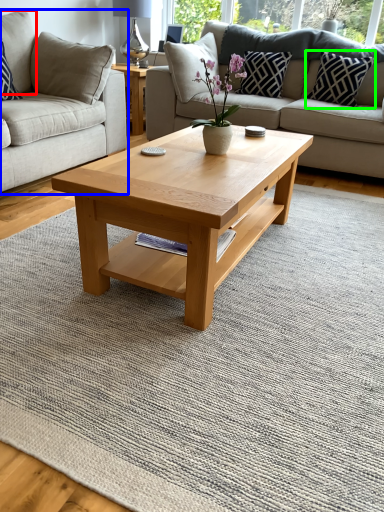
Question: Based on their relative distances, which object is nearer to pillow (highlighted by a red box)? Choose from studio couch (highlighted by a blue box) and pillow (highlighted by a green box).

Choices:
 (A) studio couch
 (B) pillow

Answer: (A)